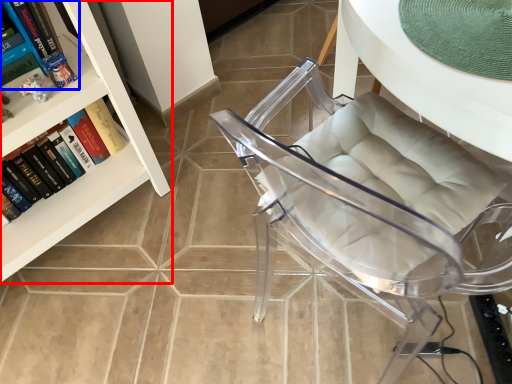
Question: Which object appears farthest to the camera in this image, bookcase (highlighted by a red box) or book (highlighted by a blue box)?

Choices:
 (A) bookcase
 (B) book

Answer: (B)